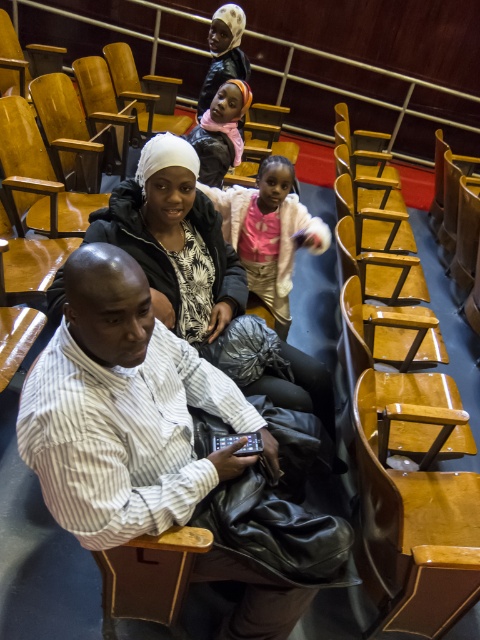
You are an usher in an auditorium and need to guide someone to the striped cotton shirt at center and the pink fleece jacket at center. Which one is closer to the front of the auditorium?

The striped cotton shirt at center is positioned under the pink fleece jacket at center, so the striped cotton shirt at center is closer to the front of the auditorium.